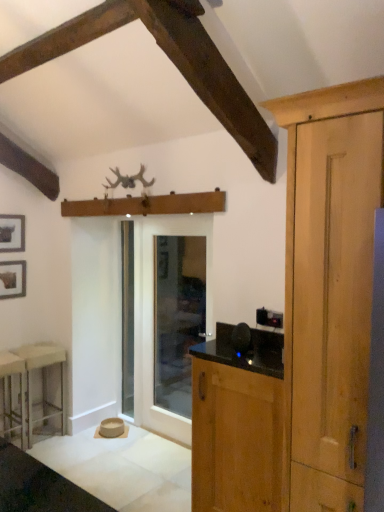
Question: Is wooden cabinet at right turned away from white plastic stool at left, the 1th stool positioned from the back?

Choices:
 (A) yes
 (B) no

Answer: (B)

Question: Considering the relative sizes of wooden cabinet at right and white plastic stool at left, the 1th stool positioned from the back, in the image provided, is wooden cabinet at right smaller than white plastic stool at left, the 1th stool positioned from the back,?

Choices:
 (A) yes
 (B) no

Answer: (B)

Question: From the image's perspective, would you say wooden cabinet at right is positioned over white plastic stool at left, the second stool when ordered from front to back?

Choices:
 (A) yes
 (B) no

Answer: (A)

Question: Is wooden cabinet at right at the left side of white plastic stool at left, the second stool when ordered from front to back?

Choices:
 (A) yes
 (B) no

Answer: (B)

Question: Considering the relative positions of wooden cabinet at right and white plastic stool at left, the 1th stool positioned from the back, in the image provided, is wooden cabinet at right to the right of white plastic stool at left, the 1th stool positioned from the back, from the viewer's perspective?

Choices:
 (A) yes
 (B) no

Answer: (A)

Question: From a real-world perspective, is wooden cabinet at right located beneath white plastic stool at left, the 1th stool positioned from the back?

Choices:
 (A) no
 (B) yes

Answer: (A)

Question: From a real-world perspective, is matte black picture frame at upper left, which appears as the second picture frame when ordered from the bottom, below clear glass door at center, which is counted as the 1th screen door, starting from the right?

Choices:
 (A) no
 (B) yes

Answer: (A)

Question: Considering the relative positions of matte black picture frame at upper left, which appears as the first picture frame when viewed from the top, and clear glass door at center, the 2th screen door when ordered from left to right, in the image provided, is matte black picture frame at upper left, which appears as the first picture frame when viewed from the top, behind clear glass door at center, the 2th screen door when ordered from left to right,?

Choices:
 (A) yes
 (B) no

Answer: (A)

Question: From a real-world perspective, is matte black picture frame at upper left, which appears as the first picture frame when viewed from the top, on top of clear glass door at center, the 2th screen door when ordered from left to right?

Choices:
 (A) no
 (B) yes

Answer: (B)

Question: Considering the relative sizes of matte black picture frame at upper left, which appears as the second picture frame when ordered from the bottom, and clear glass door at center, the 2th screen door when ordered from left to right, in the image provided, is matte black picture frame at upper left, which appears as the second picture frame when ordered from the bottom, thinner than clear glass door at center, the 2th screen door when ordered from left to right,?

Choices:
 (A) no
 (B) yes

Answer: (B)

Question: Considering the relative sizes of matte black picture frame at upper left, which appears as the second picture frame when ordered from the bottom, and clear glass door at center, the 2th screen door when ordered from left to right, in the image provided, is matte black picture frame at upper left, which appears as the second picture frame when ordered from the bottom, smaller than clear glass door at center, the 2th screen door when ordered from left to right,?

Choices:
 (A) yes
 (B) no

Answer: (A)

Question: From the image's perspective, is matte black picture frame at upper left, which appears as the second picture frame when ordered from the bottom, below clear glass door at center, the 2th screen door when ordered from left to right?

Choices:
 (A) yes
 (B) no

Answer: (B)

Question: From a real-world perspective, is matte black picture frame at upper left, which appears as the first picture frame when viewed from the top, physically above metallic silver stool at lower left, which is the 2th stool from back to front?

Choices:
 (A) yes
 (B) no

Answer: (A)